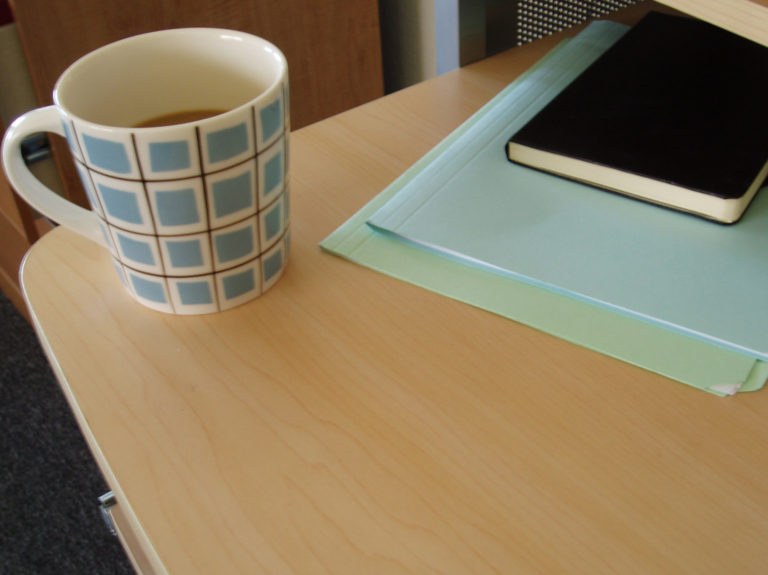
The width and height of the screenshot is (768, 575). What are the coordinates of `green folder` in the screenshot? It's located at (544, 216).